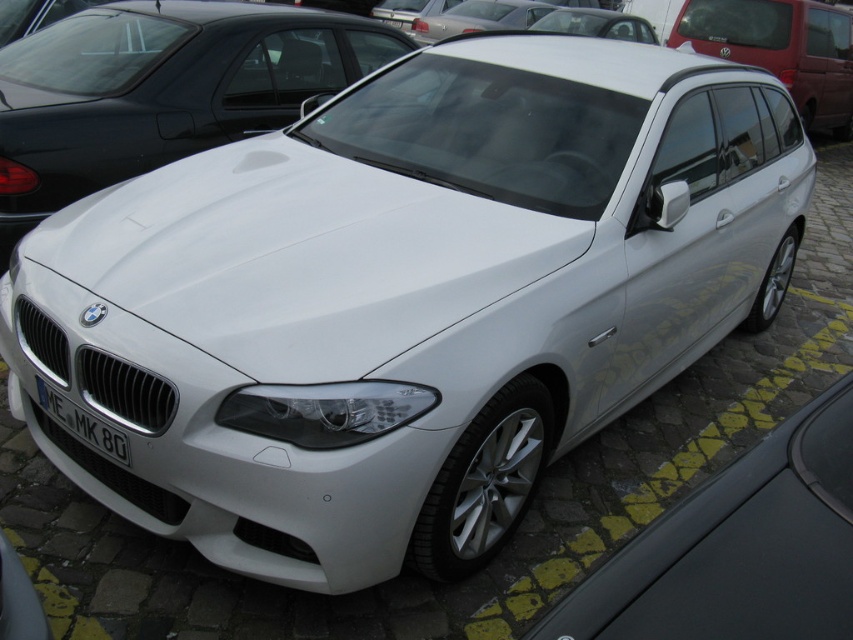
You are a parking attendant and need to guide a driver to park their car in the space between the white matte car at center and the white glossy car at upper right. Based on their positions, which car should the driver park behind?

The driver should park behind the white glossy car at upper right because the white matte car at center is positioned below it, meaning the glossy car is ahead in the parking space.

You are a parking attendant and need to determine which car is shorter between the white matte car at center and the white glossy car at upper right. Based on the scene, which one should you report as shorter?

The white matte car at center is not as tall as white glossy car at upper right, so the white matte car at center is shorter.

You are standing at the point with coordinates point (689,632) and want to move towards the point with coordinates point (22,177). Based on the scene description, will you be moving forward or backward?

Since point (22,177) is behind point (689,632), moving towards it would mean moving backward.